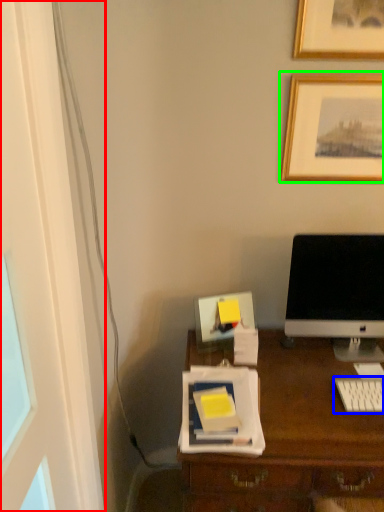
Question: Considering the real-world distances, which object is closest to glass door (highlighted by a red box)? computer keyboard (highlighted by a blue box) or picture frame (highlighted by a green box).

Choices:
 (A) computer keyboard
 (B) picture frame

Answer: (A)